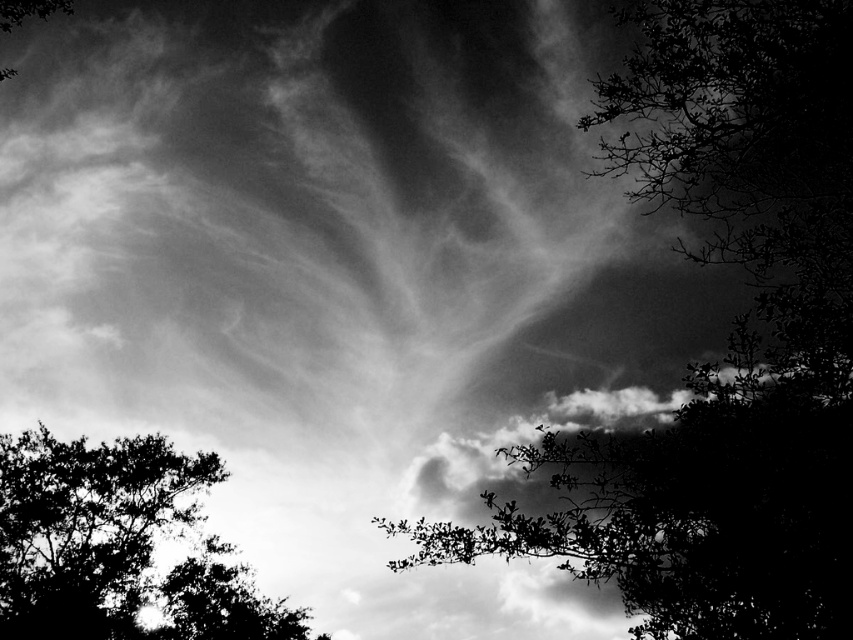
Who is positioned more to the left, silhouette leafy branch at upper right or dark leafy tree at lower left?

From the viewer's perspective, dark leafy tree at lower left appears more on the left side.

Does silhouette leafy branch at upper right have a greater height compared to dark leafy tree at lower left?

Yes.

Which is behind, point (778, 8) or point (213, 620)?

The point (213, 620) is more distant.

The width and height of the screenshot is (853, 640). Identify the location of silhouette leafy branch at upper right. tap(727, 340).